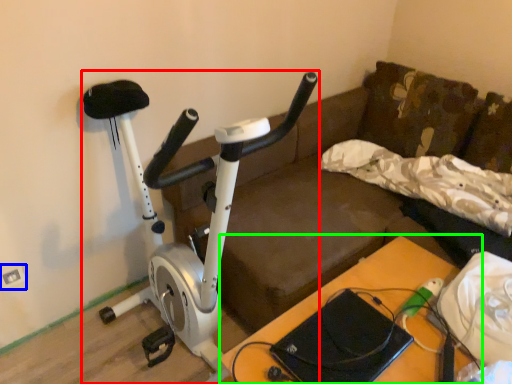
Question: Which object is the farthest from stationary bicycle (highlighted by a red box)? Choose among these: electric outlet (highlighted by a blue box) or table (highlighted by a green box).

Choices:
 (A) electric outlet
 (B) table

Answer: (A)